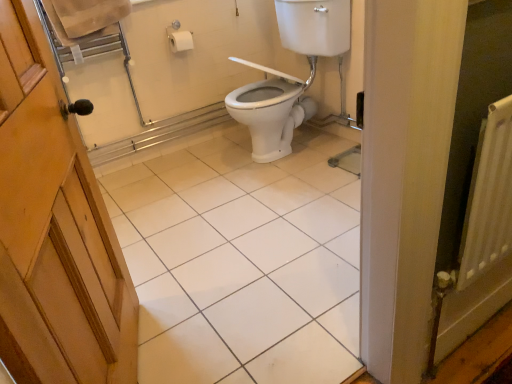
Question: In the image, is white glossy tile at center on the left side or the right side of white glossy toilet at center?

Choices:
 (A) left
 (B) right

Answer: (A)

Question: Considering the positions of white glossy tile at center and white glossy toilet at center in the image, is white glossy tile at center wider or thinner than white glossy toilet at center?

Choices:
 (A) wide
 (B) thin

Answer: (A)

Question: From the image's perspective, relative to white glossy toilet at center, is white glossy tile at center above or below?

Choices:
 (A) below
 (B) above

Answer: (A)

Question: Relative to white glossy tile at center, is white glossy toilet at center in front or behind?

Choices:
 (A) front
 (B) behind

Answer: (B)

Question: From a real-world perspective, is white glossy toilet at center positioned above or below white glossy tile at center?

Choices:
 (A) below
 (B) above

Answer: (B)

Question: Considering the positions of point (274, 6) and point (307, 292), is point (274, 6) closer or farther from the camera than point (307, 292)?

Choices:
 (A) farther
 (B) closer

Answer: (A)

Question: From the image's perspective, is white glossy toilet at center positioned above or below white glossy tile at center?

Choices:
 (A) below
 (B) above

Answer: (B)